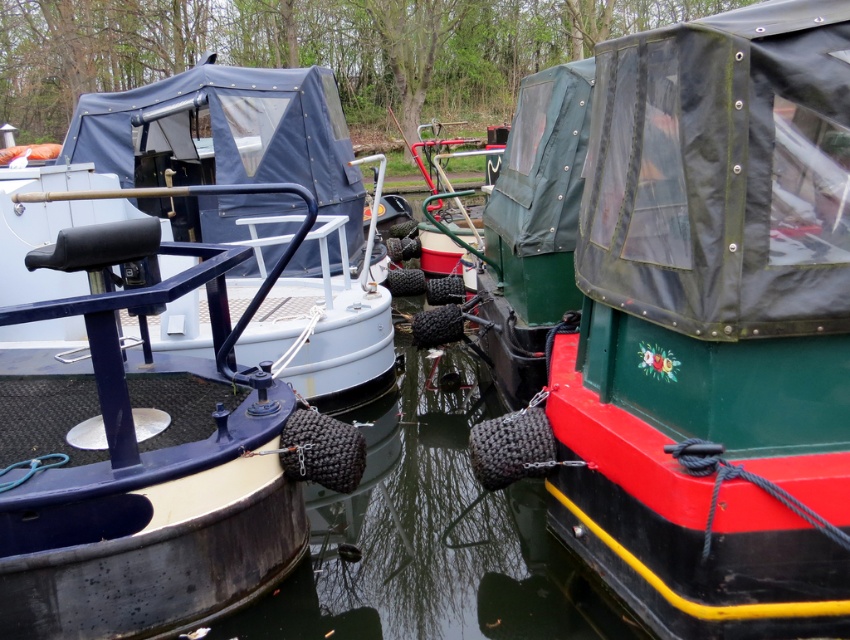
Is point (384, 612) positioned behind point (340, 376)?

No, (384, 612) is in front of (340, 376).

From the picture: Between smooth rubber fender at center and matte blue boat at left, which one is positioned lower?

smooth rubber fender at center

Between point (425, 477) and point (248, 166), which one is positioned in front?

Point (425, 477) is in front.

Where is `smooth rubber fender at center`? smooth rubber fender at center is located at coordinates (431, 534).

In the scene shown: Can you confirm if green glossy boat at center is smaller than matte blue boat at left?

Indeed, green glossy boat at center has a smaller size compared to matte blue boat at left.

Can you confirm if green glossy boat at center is bigger than matte blue boat at left?

No.

Locate an element on the screen. This screenshot has width=850, height=640. green glossy boat at center is located at coordinates (711, 326).

Is point (610, 204) positioned behind point (352, 580)?

That is False.

Image resolution: width=850 pixels, height=640 pixels. In order to click on green glossy boat at center in this screenshot , I will do `click(711, 326)`.

Measure the distance between point (829, 456) and camera.

Point (829, 456) and camera are 2.86 meters apart.

Where is `green glossy boat at center`? green glossy boat at center is located at coordinates [711, 326].